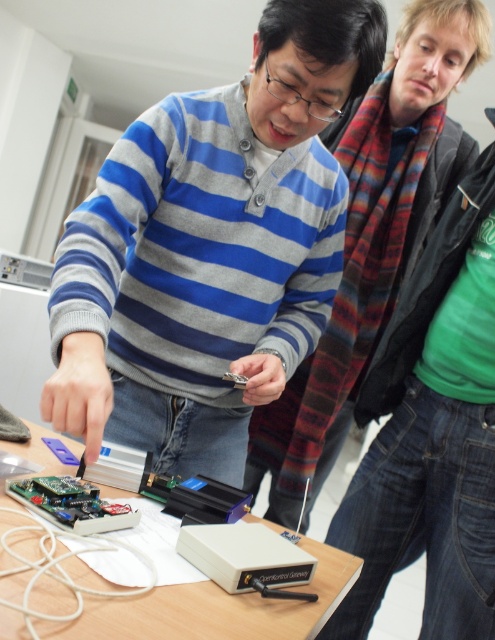
Measure the distance from striped sweater at center to green circuit board at lower left.

striped sweater at center and green circuit board at lower left are 95.45 centimeters apart from each other.

Identify the location of striped sweater at center. (374, 237).

At what (x,y) coordinates should I click in order to perform the action: click on striped sweater at center. Please return your answer as a coordinate pair (x, y). Looking at the image, I should click on (374, 237).

Is gray striped sweater at center wider than green circuit board at lower left?

Indeed, gray striped sweater at center has a greater width compared to green circuit board at lower left.

Can you confirm if gray striped sweater at center is taller than green circuit board at lower left?

Yes, gray striped sweater at center is taller than green circuit board at lower left.

This screenshot has height=640, width=495. Describe the element at coordinates (210, 248) in the screenshot. I see `gray striped sweater at center` at that location.

Find the location of a particular element. The width and height of the screenshot is (495, 640). gray striped sweater at center is located at coordinates (210, 248).

Can you confirm if wooden table at center is wider than green circuit board at lower left?

Yes.

Which of these two, wooden table at center or green circuit board at lower left, stands shorter?

green circuit board at lower left is shorter.

Between point (86, 637) and point (84, 524), which one is positioned in front?

Point (86, 637) is in front.

Where is `wooden table at center`? wooden table at center is located at coordinates (213, 609).